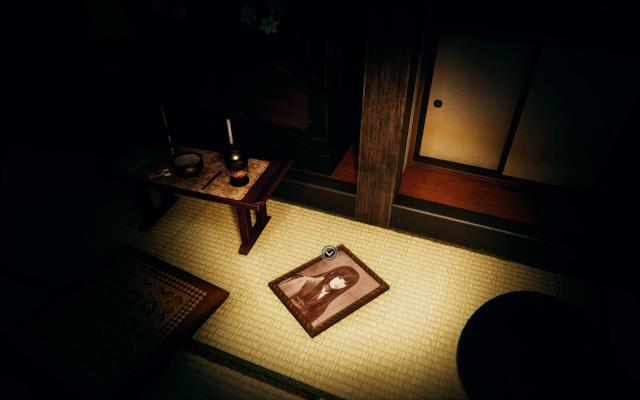
Where is `bowl`? The image size is (640, 400). bowl is located at coordinates tap(188, 167).